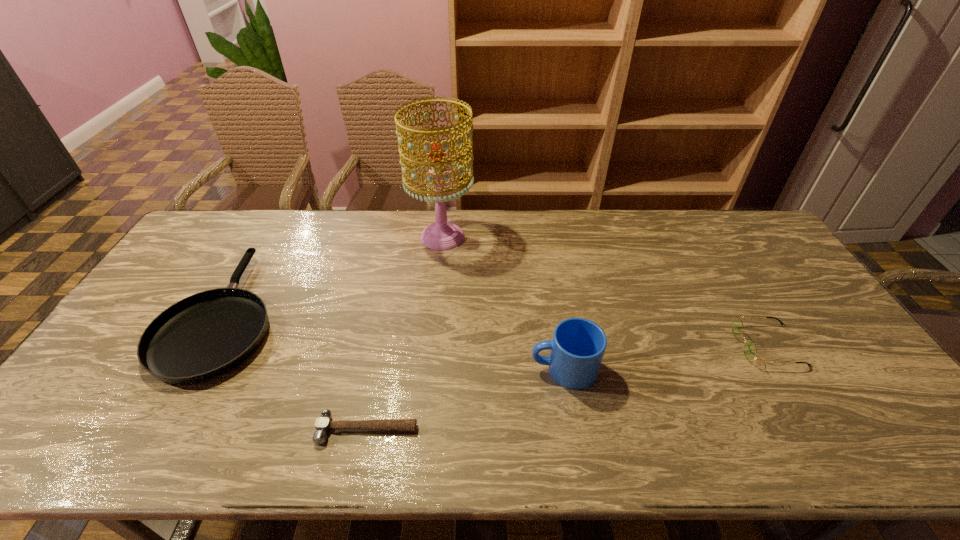
At what (x,y) coordinates should I click in order to perform the action: click on the tallest object. Please return your answer as a coordinate pair (x, y). The image size is (960, 540). Looking at the image, I should click on (442, 235).

Identify the location of mug. (578, 345).

The height and width of the screenshot is (540, 960). What are the coordinates of `the fourth shortest object` in the screenshot? It's located at (578, 345).

Identify the location of the rightmost object. This screenshot has height=540, width=960. (750, 351).

Where is `the leftmost object`? the leftmost object is located at coordinates (203, 336).

Find the location of a particular element. Image resolution: width=960 pixels, height=540 pixels. the nearest object is located at coordinates (323, 424).

You are a GUI agent. You are given a task and a screenshot of the screen. Output one action in this format:
    pyautogui.click(x=<x>, y=<y>)
    Task: Click on the hammer
    
    Given the screenshot: What is the action you would take?
    pyautogui.click(x=323, y=424)

Locate an element on the screen. free space located 0.070m on the right of the lampshade is located at coordinates (494, 237).

Image resolution: width=960 pixels, height=540 pixels. I want to click on vacant region located on the side of the fourth shortest object with the handle, so click(x=407, y=369).

Where is `vacant point located 0.270m on the side of the fourth shortest object with the handle`? vacant point located 0.270m on the side of the fourth shortest object with the handle is located at coordinates (426, 369).